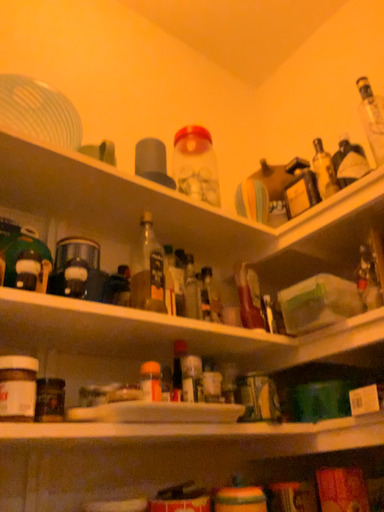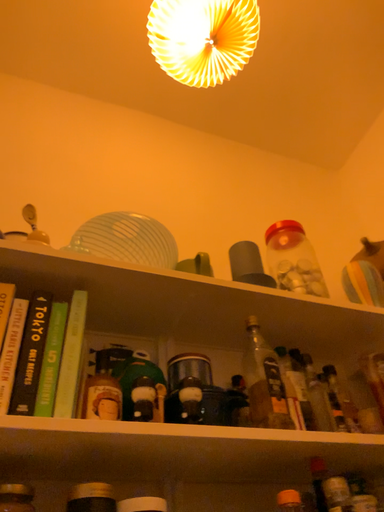
Question: How did the camera likely rotate when shooting the video?

Choices:
 (A) rotated left
 (B) rotated right

Answer: (A)